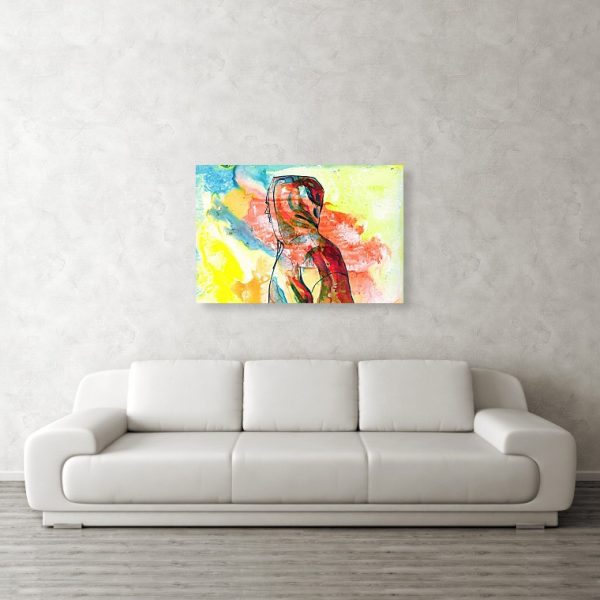
Where is `arm rest`? arm rest is located at coordinates (81, 417).